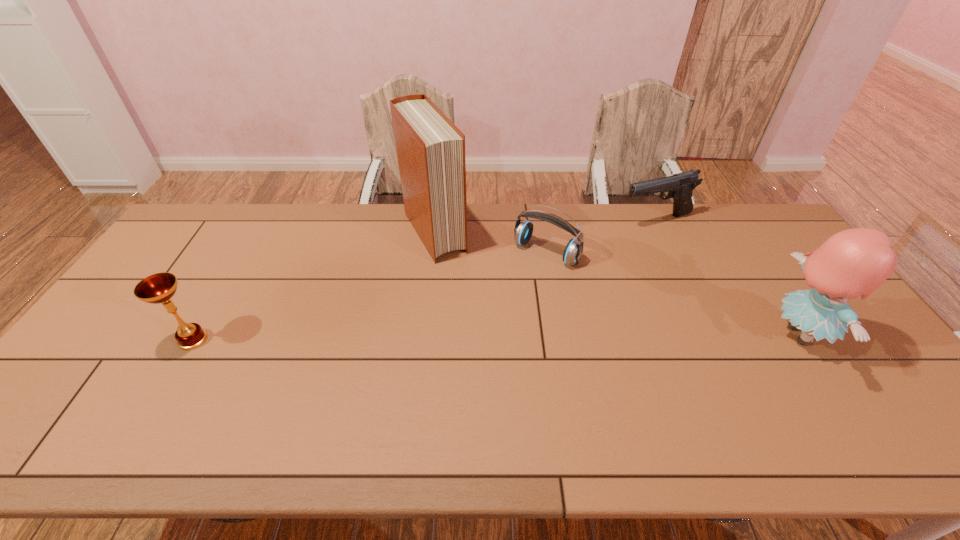
The image size is (960, 540). I want to click on hardback book that is at the far edge, so click(430, 149).

This screenshot has height=540, width=960. What are the coordinates of `object that is at the near edge` in the screenshot? It's located at (855, 262).

What are the coordinates of `object positioned at the right edge` in the screenshot? It's located at (855, 262).

This screenshot has width=960, height=540. In order to click on object at the near right corner in this screenshot , I will do click(x=855, y=262).

Identify the location of free space at the far edge. Image resolution: width=960 pixels, height=540 pixels. (667, 222).

Locate an element on the screen. This screenshot has width=960, height=540. vacant space at the near edge of the desktop is located at coordinates (432, 414).

Where is `free space at the left edge of the desktop`? The height and width of the screenshot is (540, 960). free space at the left edge of the desktop is located at coordinates (110, 353).

Find the location of a particular element. This screenshot has width=960, height=540. vacant space at the far left corner is located at coordinates (228, 228).

The image size is (960, 540). In the image, there is a desktop. Identify the location of vacant space at the far right corner. (772, 233).

Where is `vacant area between the doll and the fourth object from right to left`? Image resolution: width=960 pixels, height=540 pixels. vacant area between the doll and the fourth object from right to left is located at coordinates (616, 284).